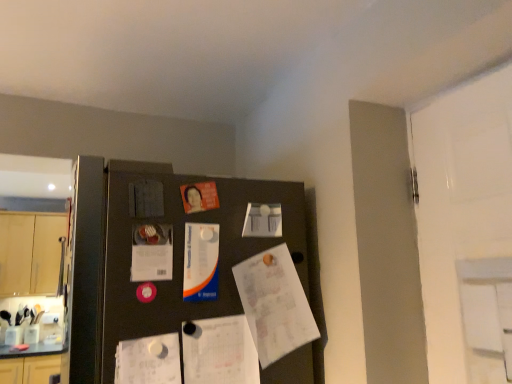
Question: Is black matte fridge at center thinner than white glossy paper at upper center, which ranks as the 5th poster in bottom-to-top order?

Choices:
 (A) yes
 (B) no

Answer: (B)

Question: Considering the relative sizes of black matte fridge at center and white glossy paper at upper center, which ranks as the 5th poster in bottom-to-top order, in the image provided, is black matte fridge at center wider than white glossy paper at upper center, which ranks as the 5th poster in bottom-to-top order,?

Choices:
 (A) no
 (B) yes

Answer: (B)

Question: Is black matte fridge at center oriented towards white glossy paper at upper center, the third poster when ordered from top to bottom?

Choices:
 (A) no
 (B) yes

Answer: (A)

Question: From the image's perspective, does black matte fridge at center appear lower than white glossy paper at upper center, which ranks as the 5th poster in bottom-to-top order?

Choices:
 (A) yes
 (B) no

Answer: (A)

Question: Can we say black matte fridge at center lies outside white glossy paper at upper center, the third poster when ordered from top to bottom?

Choices:
 (A) no
 (B) yes

Answer: (B)

Question: From the image's perspective, is metallic silver poster at center, positioned as the 6th poster in bottom-to-top order, located above or below white glossy paper at upper center, which ranks as the 5th poster in bottom-to-top order?

Choices:
 (A) below
 (B) above

Answer: (B)

Question: Is metallic silver poster at center, the 2th poster when ordered from top to bottom, inside the boundaries of white glossy paper at upper center, the third poster when ordered from top to bottom, or outside?

Choices:
 (A) outside
 (B) inside

Answer: (A)

Question: Considering their positions, is metallic silver poster at center, the 2th poster when ordered from top to bottom, located in front of or behind white glossy paper at upper center, the third poster when ordered from top to bottom?

Choices:
 (A) behind
 (B) front

Answer: (B)

Question: In terms of width, does metallic silver poster at center, positioned as the 6th poster in bottom-to-top order, look wider or thinner when compared to white glossy paper at upper center, which ranks as the 5th poster in bottom-to-top order?

Choices:
 (A) thin
 (B) wide

Answer: (A)

Question: From the image's perspective, is blue glossy poster at center, the 5th poster viewed from the top, positioned above or below metallic silver poster at center, the 2th poster when ordered from top to bottom?

Choices:
 (A) above
 (B) below

Answer: (B)

Question: Considering the positions of blue glossy poster at center, the 5th poster viewed from the top, and metallic silver poster at center, the 2th poster when ordered from top to bottom, in the image, is blue glossy poster at center, the 5th poster viewed from the top, taller or shorter than metallic silver poster at center, the 2th poster when ordered from top to bottom,?

Choices:
 (A) short
 (B) tall

Answer: (B)

Question: Is blue glossy poster at center, the 5th poster viewed from the top, situated inside metallic silver poster at center, positioned as the 6th poster in bottom-to-top order, or outside?

Choices:
 (A) inside
 (B) outside

Answer: (B)

Question: Considering their positions, is blue glossy poster at center, which appears as the third poster when ordered from the bottom, located in front of or behind metallic silver poster at center, the 2th poster when ordered from top to bottom?

Choices:
 (A) front
 (B) behind

Answer: (B)

Question: Considering the positions of white glossy paper at upper center, which ranks as the 5th poster in bottom-to-top order, and white paper at center, the first poster when ordered from bottom to top, in the image, is white glossy paper at upper center, which ranks as the 5th poster in bottom-to-top order, taller or shorter than white paper at center, the first poster when ordered from bottom to top,?

Choices:
 (A) short
 (B) tall

Answer: (A)

Question: Based on their positions, is white glossy paper at upper center, the third poster when ordered from top to bottom, located to the left or right of white paper at center, the first poster when ordered from bottom to top?

Choices:
 (A) right
 (B) left

Answer: (A)